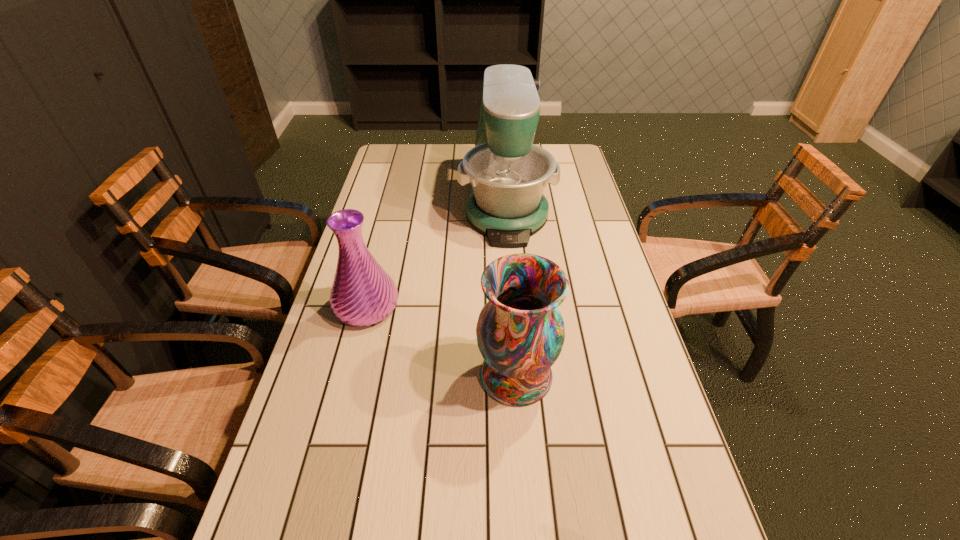
Where is `empty location between the left vase and the nearest object`? Image resolution: width=960 pixels, height=540 pixels. empty location between the left vase and the nearest object is located at coordinates (442, 341).

This screenshot has width=960, height=540. I want to click on vacant area that lies between the second farthest object and the right vase, so click(x=442, y=341).

Locate an element on the screen. vacant space that's between the farther vase and the tallest object is located at coordinates (436, 252).

The height and width of the screenshot is (540, 960). I want to click on free area in between the farthest object and the leftmost object, so 436,252.

Point out which object is positioned as the second nearest to the nearest object. Please provide its 2D coordinates. Your answer should be formatted as a tuple, i.e. [(x, y)], where the tuple contains the x and y coordinates of a point satisfying the conditions above.

[(507, 173)]

Where is `object that is the second closest to the nearest object`? The width and height of the screenshot is (960, 540). object that is the second closest to the nearest object is located at coordinates (507, 173).

The width and height of the screenshot is (960, 540). Identify the location of vacant area that satisfies the following two spatial constraints: 1. on the front side of the second nearest object; 2. on the right side of the right vase. (349, 375).

Locate an element on the screen. The width and height of the screenshot is (960, 540). free point that satisfies the following two spatial constraints: 1. on the front side of the second nearest object; 2. on the left side of the nearer vase is located at coordinates (349, 375).